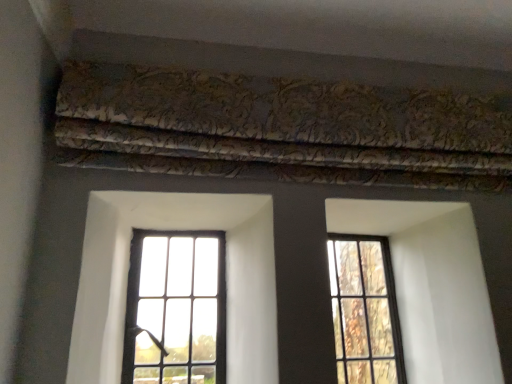
Describe the element at coordinates (281, 128) in the screenshot. I see `gold-patterned fabric at upper center` at that location.

I want to click on gold-patterned fabric at upper center, so click(281, 128).

From their relative heights in the image, would you say gold-patterned fabric at upper center is taller or shorter than clear glass window at center, which is counted as the 1th window, starting from the left?

gold-patterned fabric at upper center is shorter than clear glass window at center, which is counted as the 1th window, starting from the left.

From a real-world perspective, does gold-patterned fabric at upper center sit lower than clear glass window at center, which is counted as the 1th window, starting from the left?

No.

From the image's perspective, which is above, gold-patterned fabric at upper center or clear glass window at center, which is counted as the 1th window, starting from the left?

gold-patterned fabric at upper center appears higher in the image.

Would you say clear glass window at center, which is counted as the 1th window, starting from the left, is part of gold-patterned fabric at upper center's contents?

No, clear glass window at center, which is counted as the 1th window, starting from the left, is not surrounded by gold-patterned fabric at upper center.

You are a GUI agent. You are given a task and a screenshot of the screen. Output one action in this format:
    pyautogui.click(x=<x>, y=<y>)
    Task: Click on the 2nd window below the gold-patterned fabric at upper center (from the image's perspective)
    
    Given the screenshot: What is the action you would take?
    pyautogui.click(x=365, y=311)

Would you say clear glass window at right, the first window when ordered from right to left, is to the left or to the right of gold-patterned fabric at upper center in the picture?

clear glass window at right, the first window when ordered from right to left, is positioned on gold-patterned fabric at upper center's right side.

Can we say clear glass window at right, acting as the 2th window starting from the left, lies outside gold-patterned fabric at upper center?

Yes, clear glass window at right, acting as the 2th window starting from the left, is not within gold-patterned fabric at upper center.

Is clear glass window at right, acting as the 2th window starting from the left, far from gold-patterned fabric at upper center?

No, clear glass window at right, acting as the 2th window starting from the left, is not far away from gold-patterned fabric at upper center.

Does clear glass window at center, placed as the 2th window when sorted from right to left, have a lesser height compared to clear glass window at right, the first window when ordered from right to left?

Correct, clear glass window at center, placed as the 2th window when sorted from right to left, is not as tall as clear glass window at right, the first window when ordered from right to left.

Is clear glass window at center, placed as the 2th window when sorted from right to left, at the left side of clear glass window at right, the first window when ordered from right to left?

Yes.

What are the coordinates of `window located on the right of clear glass window at center, which is counted as the 1th window, starting from the left` in the screenshot? It's located at (365, 311).

Do you think clear glass window at center, which is counted as the 1th window, starting from the left, is within clear glass window at right, the first window when ordered from right to left, or outside of it?

clear glass window at center, which is counted as the 1th window, starting from the left, is not enclosed by clear glass window at right, the first window when ordered from right to left.

In the image, is gold-patterned fabric at upper center positioned in front of or behind clear glass window at right, the first window when ordered from right to left?

gold-patterned fabric at upper center is positioned closer to the viewer than clear glass window at right, the first window when ordered from right to left.

From the picture: Is clear glass window at right, acting as the 2th window starting from the left, completely or partially inside gold-patterned fabric at upper center?

Actually, clear glass window at right, acting as the 2th window starting from the left, is outside gold-patterned fabric at upper center.

Does point (206, 76) come closer to viewer compared to point (339, 383)?

That is True.

Considering the relative sizes of gold-patterned fabric at upper center and clear glass window at right, the first window when ordered from right to left, in the image provided, is gold-patterned fabric at upper center wider than clear glass window at right, the first window when ordered from right to left,?

Indeed, gold-patterned fabric at upper center has a greater width compared to clear glass window at right, the first window when ordered from right to left.

Can you tell me how much clear glass window at center, placed as the 2th window when sorted from right to left, and gold-patterned fabric at upper center differ in facing direction?

clear glass window at center, placed as the 2th window when sorted from right to left, and gold-patterned fabric at upper center are facing 1.26 degrees away from each other.

Is clear glass window at center, placed as the 2th window when sorted from right to left, wider than gold-patterned fabric at upper center?

No, clear glass window at center, placed as the 2th window when sorted from right to left, is not wider than gold-patterned fabric at upper center.

Is clear glass window at center, placed as the 2th window when sorted from right to left, bigger than gold-patterned fabric at upper center?

Incorrect, clear glass window at center, placed as the 2th window when sorted from right to left, is not larger than gold-patterned fabric at upper center.

Is clear glass window at center, placed as the 2th window when sorted from right to left, facing away from gold-patterned fabric at upper center?

No, clear glass window at center, placed as the 2th window when sorted from right to left,'s orientation is not away from gold-patterned fabric at upper center.

What's the angular difference between clear glass window at right, acting as the 2th window starting from the left, and clear glass window at center, placed as the 2th window when sorted from right to left,'s facing directions?

0.805 degrees separate the facing orientations of clear glass window at right, acting as the 2th window starting from the left, and clear glass window at center, placed as the 2th window when sorted from right to left.

From a real-world perspective, is clear glass window at right, acting as the 2th window starting from the left, physically located above or below clear glass window at center, placed as the 2th window when sorted from right to left?

clear glass window at right, acting as the 2th window starting from the left, is below clear glass window at center, placed as the 2th window when sorted from right to left.

Is point (381, 358) closer or farther from the camera than point (153, 299)?

Point (381, 358) is farther from the camera than point (153, 299).

At what (x,y) coordinates should I click in order to perform the action: click on window in front of the clear glass window at right, acting as the 2th window starting from the left. Please return your answer as a coordinate pair (x, y). This screenshot has width=512, height=384. Looking at the image, I should click on (176, 308).

The width and height of the screenshot is (512, 384). I want to click on curtain located above the clear glass window at center, placed as the 2th window when sorted from right to left (from the image's perspective), so click(x=281, y=128).

You are a GUI agent. You are given a task and a screenshot of the screen. Output one action in this format:
    pyautogui.click(x=<x>, y=<y>)
    Task: Click on the 2nd window behind the gold-patterned fabric at upper center
    
    Given the screenshot: What is the action you would take?
    pyautogui.click(x=365, y=311)

Looking at the image, which one is located closer to clear glass window at right, the first window when ordered from right to left, gold-patterned fabric at upper center or clear glass window at center, which is counted as the 1th window, starting from the left?

clear glass window at center, which is counted as the 1th window, starting from the left, is positioned closer to the anchor clear glass window at right, the first window when ordered from right to left.

Estimate the real-world distances between objects in this image. Which object is further from clear glass window at right, acting as the 2th window starting from the left, clear glass window at center, which is counted as the 1th window, starting from the left, or gold-patterned fabric at upper center?

gold-patterned fabric at upper center lies further to clear glass window at right, acting as the 2th window starting from the left, than the other object.

Based on the photo, which object lies further to the anchor point clear glass window at center, placed as the 2th window when sorted from right to left, clear glass window at right, the first window when ordered from right to left, or gold-patterned fabric at upper center?

gold-patterned fabric at upper center is positioned further to the anchor clear glass window at center, placed as the 2th window when sorted from right to left.

Which object lies further to the anchor point gold-patterned fabric at upper center, clear glass window at right, acting as the 2th window starting from the left, or clear glass window at center, which is counted as the 1th window, starting from the left?

Based on the image, clear glass window at center, which is counted as the 1th window, starting from the left, appears to be further to gold-patterned fabric at upper center.

Estimate the real-world distances between objects in this image. Which object is further from clear glass window at center, placed as the 2th window when sorted from right to left, gold-patterned fabric at upper center or clear glass window at right, acting as the 2th window starting from the left?

gold-patterned fabric at upper center lies further to clear glass window at center, placed as the 2th window when sorted from right to left, than the other object.

Based on their spatial positions, is clear glass window at center, which is counted as the 1th window, starting from the left, or clear glass window at right, the first window when ordered from right to left, closer to gold-patterned fabric at upper center?

clear glass window at right, the first window when ordered from right to left, lies closer to gold-patterned fabric at upper center than the other object.

I want to click on window between gold-patterned fabric at upper center and clear glass window at right, the first window when ordered from right to left, in the up-down direction, so click(x=176, y=308).